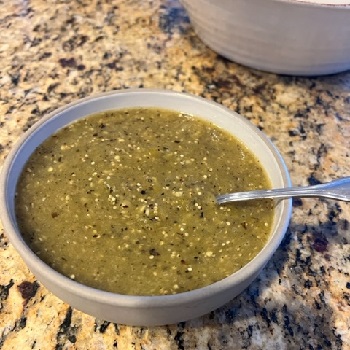
Where is `marble`? This screenshot has width=350, height=350. marble is located at coordinates (41, 324).